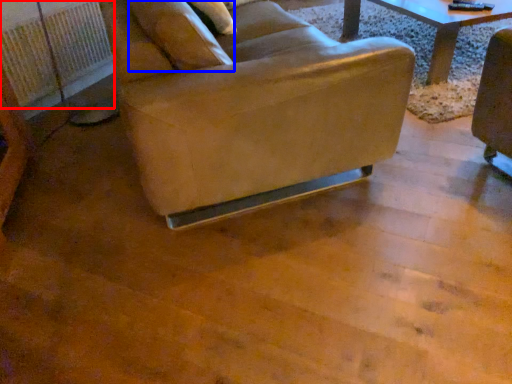
Question: Among these objects, which one is nearest to the camera, radiator (highlighted by a red box) or pillow (highlighted by a blue box)?

Choices:
 (A) radiator
 (B) pillow

Answer: (B)